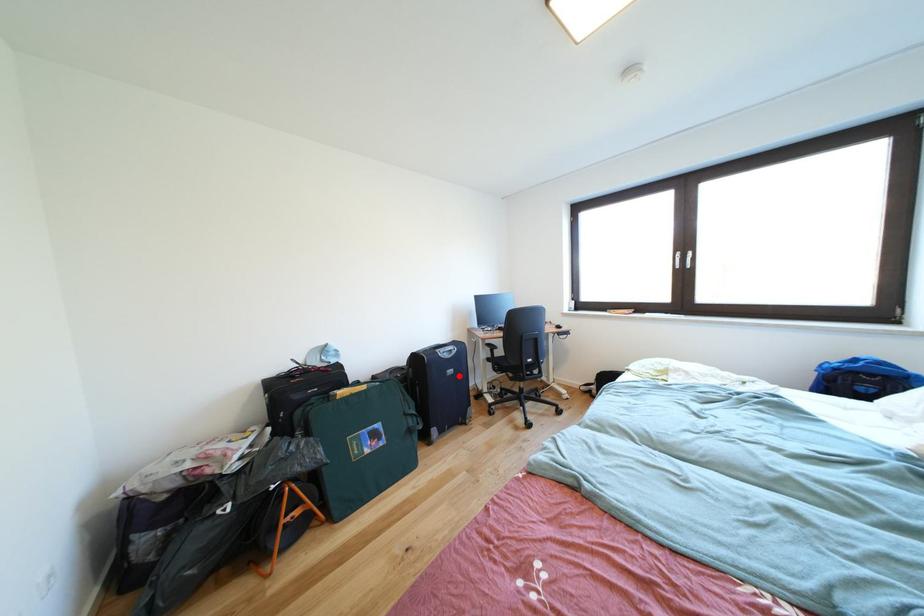
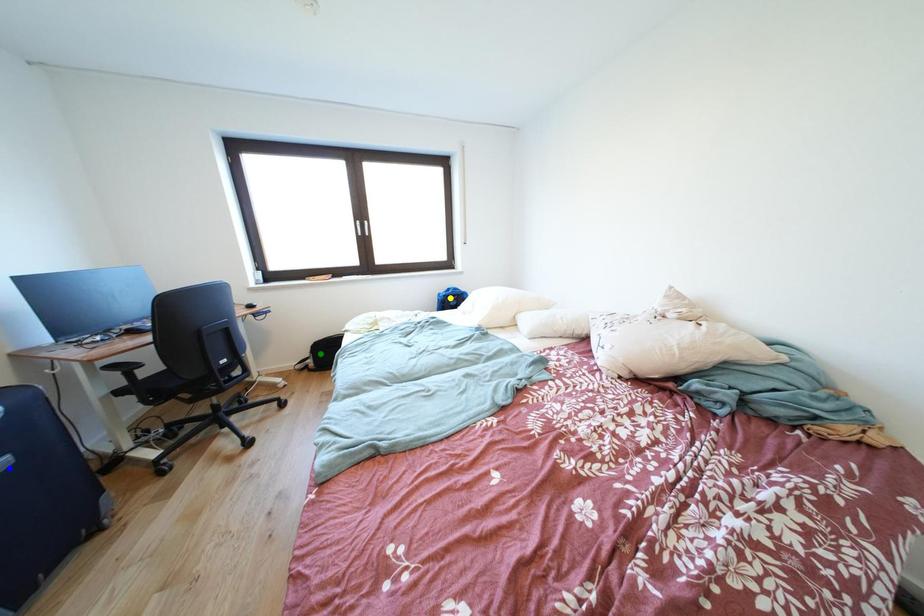
Question: I am providing you with two images of the same scene from different viewpoints. A red point is marked on the first image. You are given multiple points on the second image. Which mark in image 2 goes with the point in image 1?

Choices:
 (A) yellow point
 (B) green point
 (C) blue point

Answer: (C)